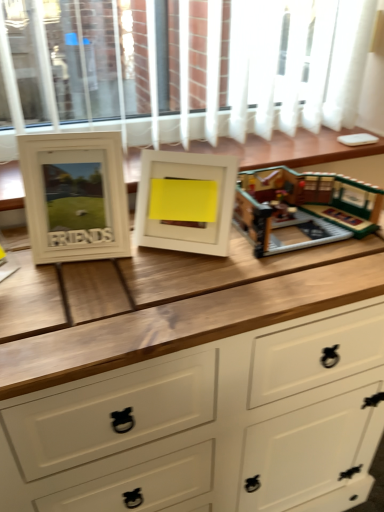
Question: Considering the positions of point (362, 394) and point (256, 212), is point (362, 394) closer or farther from the camera than point (256, 212)?

Choices:
 (A) farther
 (B) closer

Answer: (A)

Question: Would you say white wood chest of drawers at center is to the left or to the right of brick-like lego set at center in the picture?

Choices:
 (A) right
 (B) left

Answer: (B)

Question: Which of these objects is positioned farthest from the white wood chest of drawers at center?

Choices:
 (A) white matte picture frame at center, which ranks as the second picture frame in left-to-right order
 (B) white wooden buffet at center
 (C) white matte picture frame at left, the 2th picture frame positioned from the right
 (D) brick-like lego set at center

Answer: (B)

Question: Estimate the real-world distances between objects in this image. Which object is farther from the brick-like lego set at center?

Choices:
 (A) white wood chest of drawers at center
 (B) white matte picture frame at center, which ranks as the second picture frame in left-to-right order
 (C) white wooden buffet at center
 (D) white matte picture frame at left, the 2th picture frame positioned from the right

Answer: (D)